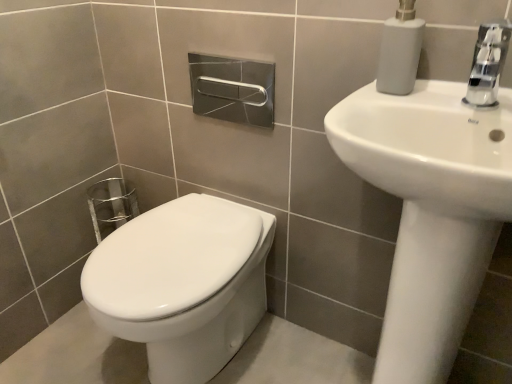
Question: From the image's perspective, is white matte soap dispenser at upper right located above or below chrome metallic faucet at upper right?

Choices:
 (A) above
 (B) below

Answer: (A)

Question: Considering their positions, is white matte soap dispenser at upper right located in front of or behind chrome metallic faucet at upper right?

Choices:
 (A) front
 (B) behind

Answer: (B)

Question: Based on their relative distances, which object is nearer to the white matte soap dispenser at upper right?

Choices:
 (A) white glossy toilet at lower left
 (B) white glossy sink at upper right
 (C) chrome metallic faucet at upper right

Answer: (C)

Question: Estimate the real-world distances between objects in this image. Which object is closer to the white glossy toilet at lower left?

Choices:
 (A) white matte soap dispenser at upper right
 (B) white glossy sink at upper right
 (C) chrome metallic faucet at upper right

Answer: (B)